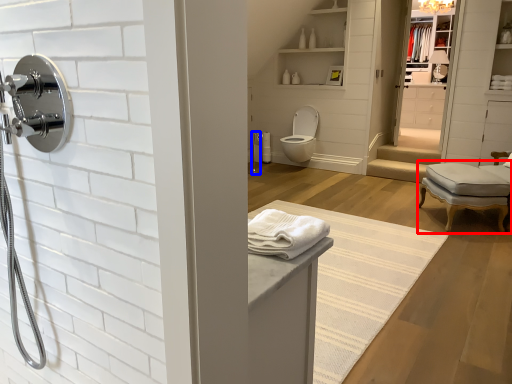
Question: Which object appears closest to the camera in this image, chair (highlighted by a red box) or shower (highlighted by a blue box)?

Choices:
 (A) chair
 (B) shower

Answer: (A)